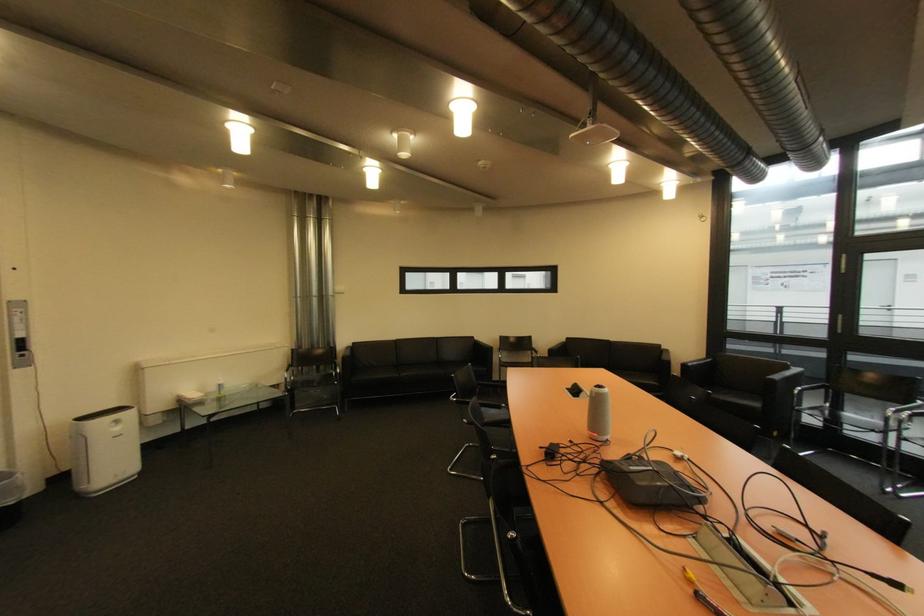
This screenshot has height=616, width=924. What do you see at coordinates (599, 413) in the screenshot? I see `a white paper stack` at bounding box center [599, 413].